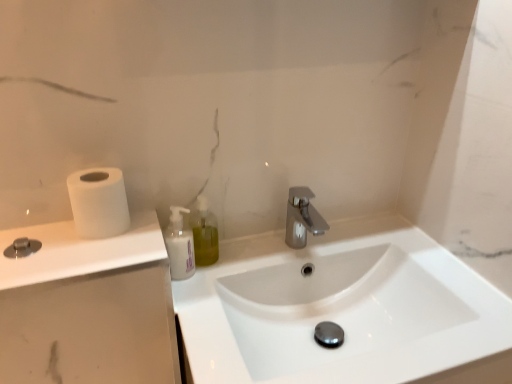
You are a GUI agent. You are given a task and a screenshot of the screen. Output one action in this format:
    pyautogui.click(x=<x>, y=<y>)
    Task: Click on the free location to the left of polished chrome faucet at center
    The width and height of the screenshot is (512, 384).
    Given the screenshot: What is the action you would take?
    pyautogui.click(x=242, y=259)